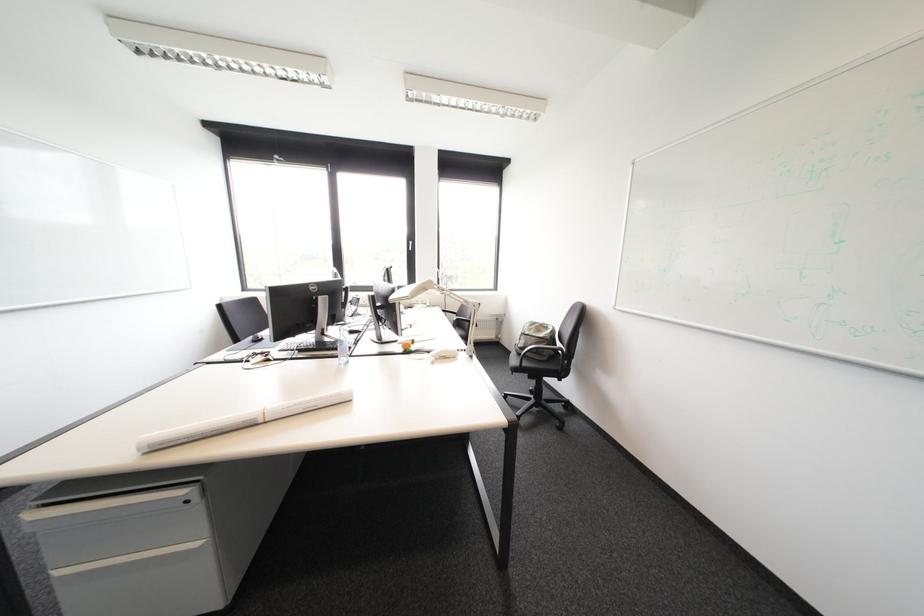
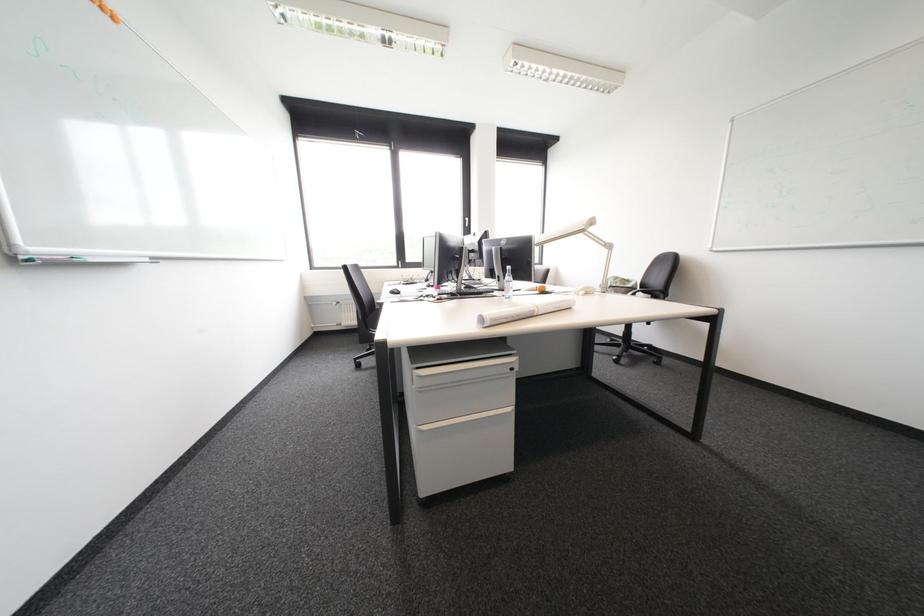
Locate, in the second image, the point that corresponds to pixel 387 338 in the first image.

(509, 289)